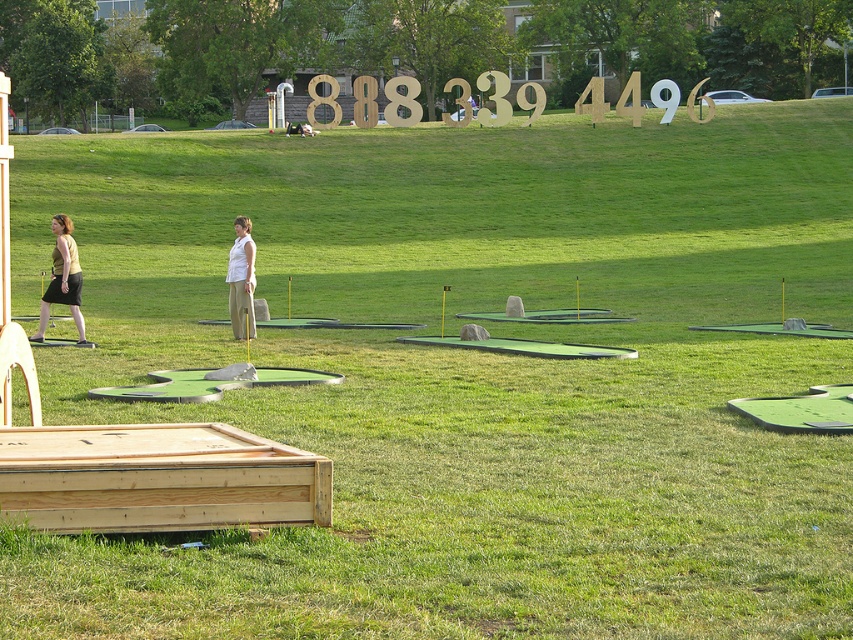
You are playing mini golf and notice two players wearing the matte yellow shirt at left and the white cotton shirt at center. Which player is standing closer to the ground?

The matte yellow shirt at left is below the white cotton shirt at center, so the player wearing the matte yellow shirt at left is standing closer to the ground.

In the scene shown: You are playing mini golf and need to locate your friend wearing a matte yellow shirt at left. According to the scene, where should you look relative to the putting surfaces?

The matte yellow shirt at left is located at the 2D coordinates point (62, 278), which is in the foreground near the wooden platform, so you should look towards the left side near the starting area of the mini golf course.